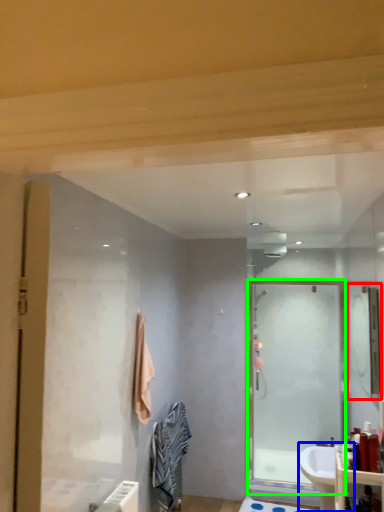
Question: Which object is positioned closest to mirror (highlighted by a red box)? Select from sink (highlighted by a blue box) and screen door (highlighted by a green box).

Choices:
 (A) sink
 (B) screen door

Answer: (B)